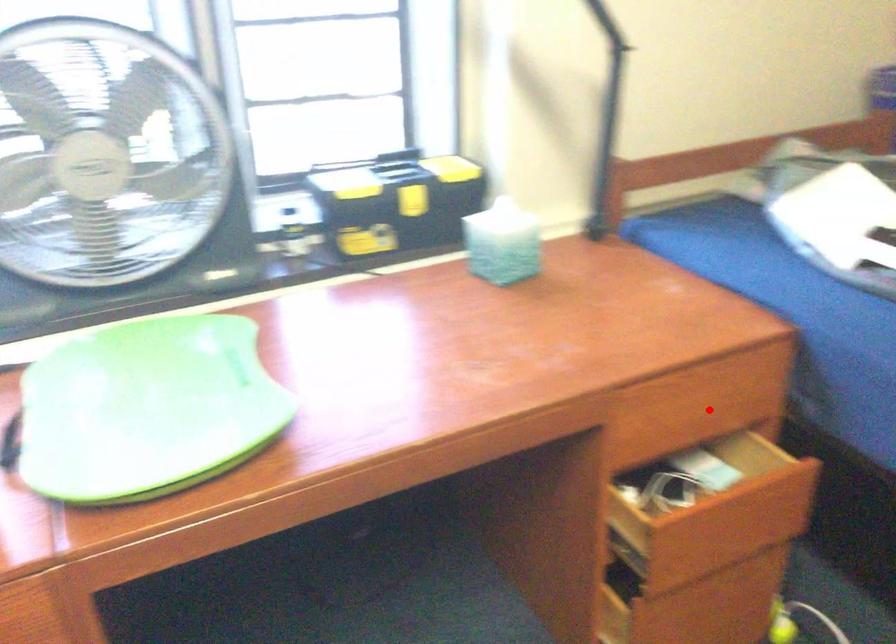
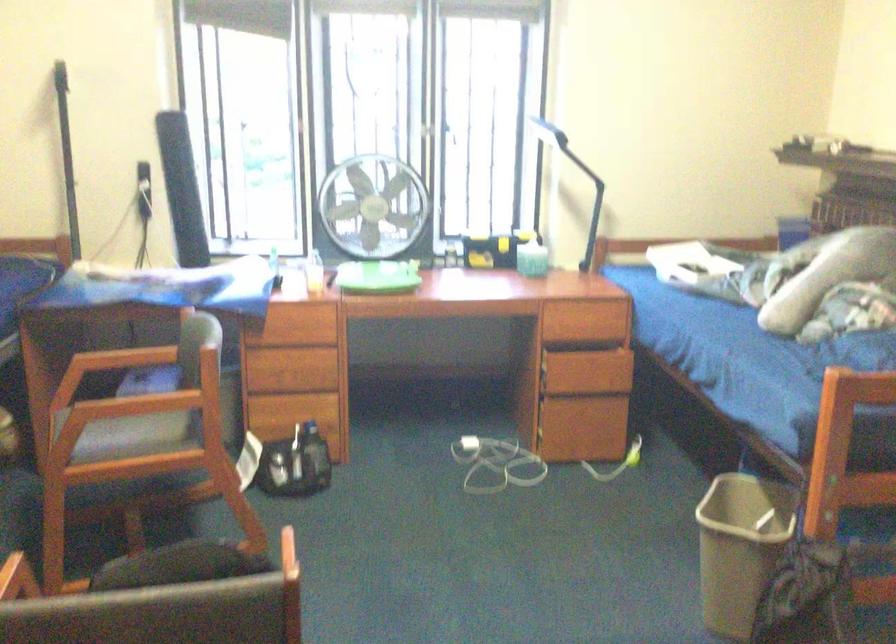
Question: A red point is marked in image1. In image2, is the corresponding 3D point closer to the camera or farther? Reply with the corresponding letter.

Choices:
 (A) The corresponding 3D point is closer.
 (B) The corresponding 3D point is farther.

Answer: (B)